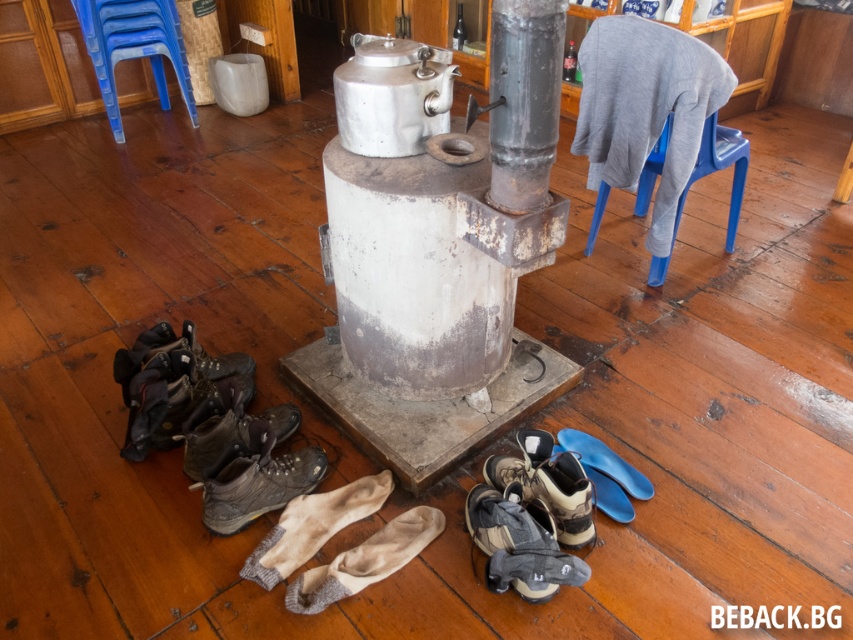
Is point (563, 512) closer to viewer compared to point (560, 442)?

Yes.

Can you confirm if brown suede shoes at lower center is wider than blue rubber shoe at lower center?

Yes, brown suede shoes at lower center is wider than blue rubber shoe at lower center.

Does point (541, 460) come behind point (630, 476)?

No, it is in front of (630, 476).

At what (x,y) coordinates should I click in order to perform the action: click on brown suede shoes at lower center. Please return your answer as a coordinate pair (x, y). The image size is (853, 640). Looking at the image, I should click on (548, 483).

Does metallic gray pillar at center have a lesser height compared to leather/rough hiking boot at lower center?

In fact, metallic gray pillar at center may be taller than leather/rough hiking boot at lower center.

Between metallic gray pillar at center and leather/rough hiking boot at lower center, which one is positioned higher?

Positioned higher is metallic gray pillar at center.

This screenshot has width=853, height=640. I want to click on metallic gray pillar at center, so click(x=524, y=100).

Is point (114, 132) less distant than point (212, 513)?

No, (114, 132) is further to viewer.

Is point (154, 76) farther from camera compared to point (247, 502)?

Yes, point (154, 76) is behind point (247, 502).

You are a GUI agent. You are given a task and a screenshot of the screen. Output one action in this format:
    pyautogui.click(x=<x>, y=<y>)
    Task: Click on the blue plastic stool at upper left
    Image resolution: width=853 pixels, height=640 pixels.
    Given the screenshot: What is the action you would take?
    pyautogui.click(x=132, y=45)